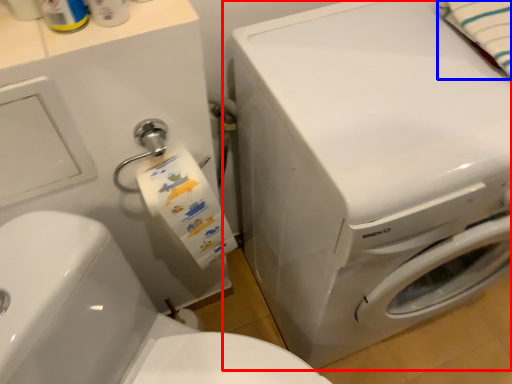
Question: Which of the following is the closest to the observer, washing machine (highlighted by a red box) or bath towel (highlighted by a blue box)?

Choices:
 (A) washing machine
 (B) bath towel

Answer: (A)